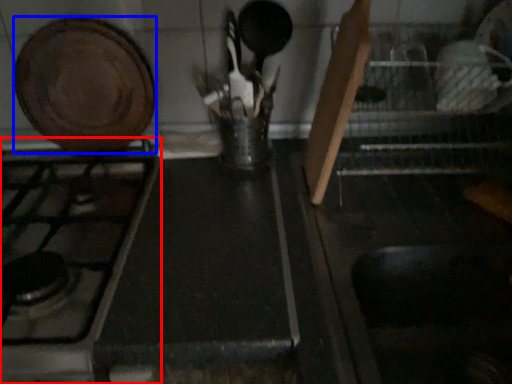
Question: Which object appears closest to the camera in this image, gas stove (highlighted by a red box) or kitchen appliance (highlighted by a blue box)?

Choices:
 (A) gas stove
 (B) kitchen appliance

Answer: (A)